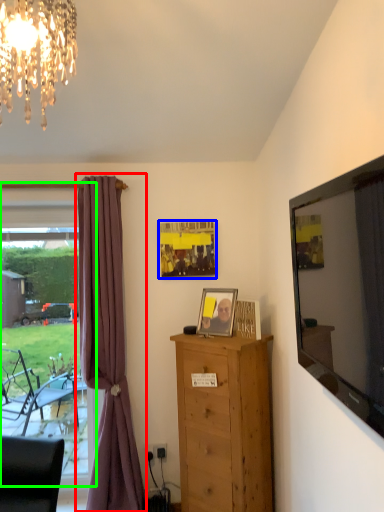
Question: Estimate the real-world distances between objects in this image. Which object is closer to curtain (highlighted by a red box), picture frame (highlighted by a blue box) or window frame (highlighted by a green box)?

Choices:
 (A) picture frame
 (B) window frame

Answer: (A)